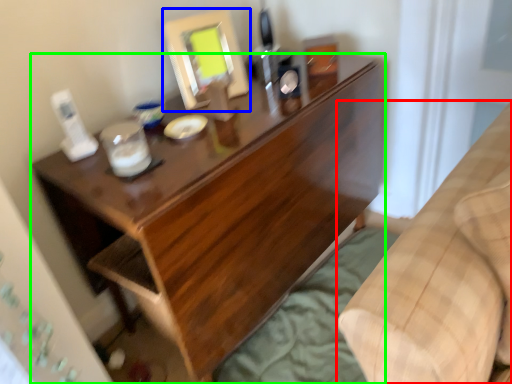
Question: Which object is the farthest from furniture (highlighted by a red box)? Choose among these: mirror (highlighted by a blue box) or desk (highlighted by a green box).

Choices:
 (A) mirror
 (B) desk

Answer: (A)